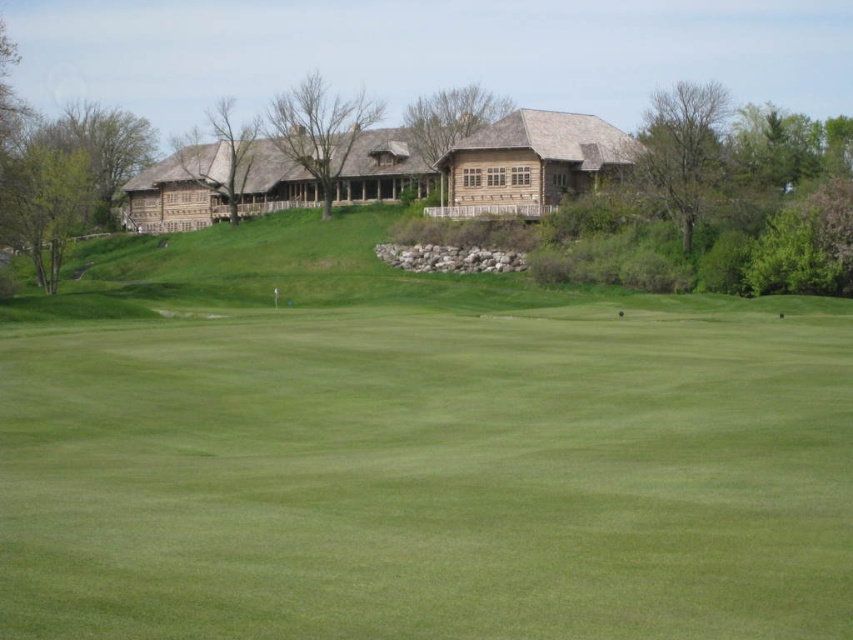
You are a golfer standing on the green grass at upper center and want to reach the wooden cabin at center. Which direction should you walk to get there?

Since the green grass at upper center is in front of the wooden cabin at center, you should walk backward or towards the lower direction to reach the wooden cabin at center.